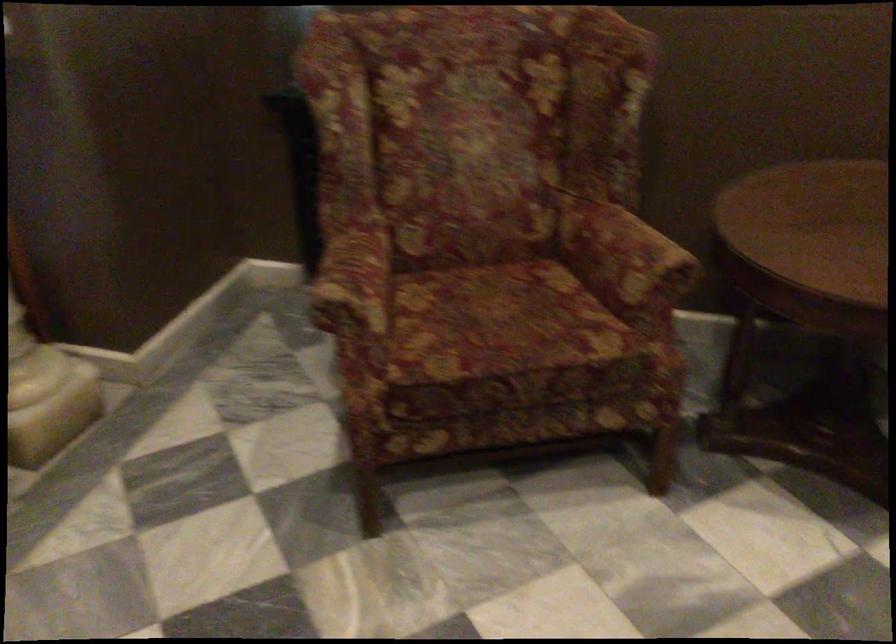
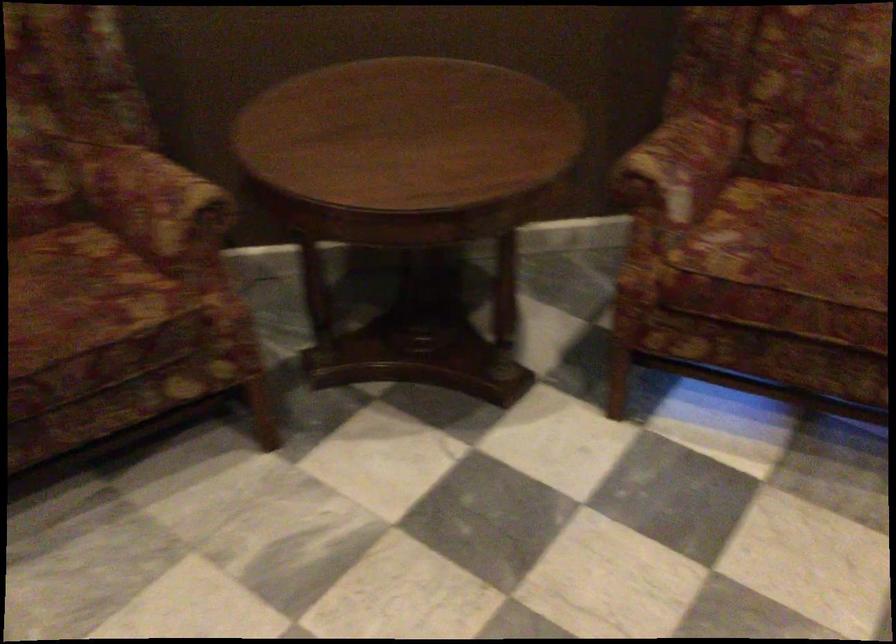
Where in the second image is the point corresponding to the point at 547,317 from the first image?

(80, 292)